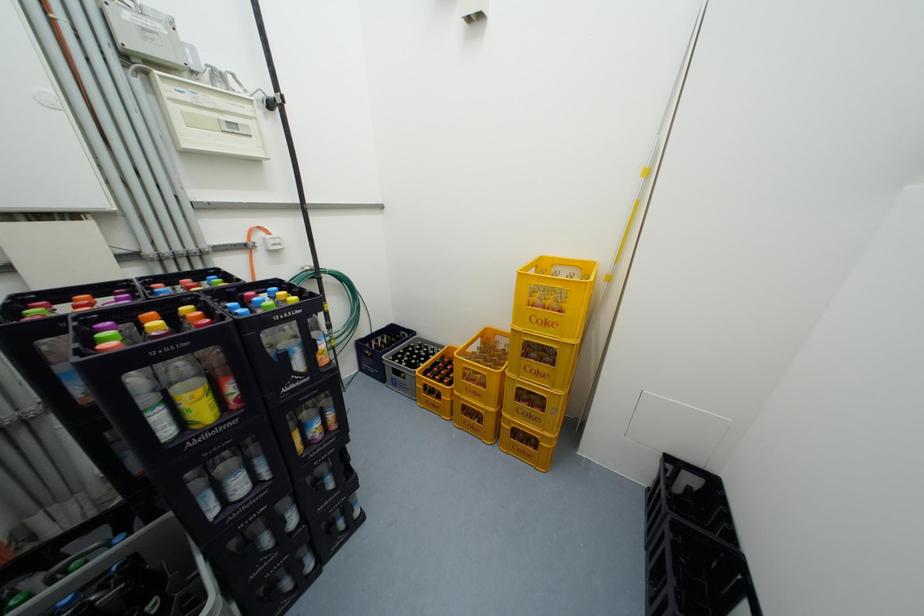
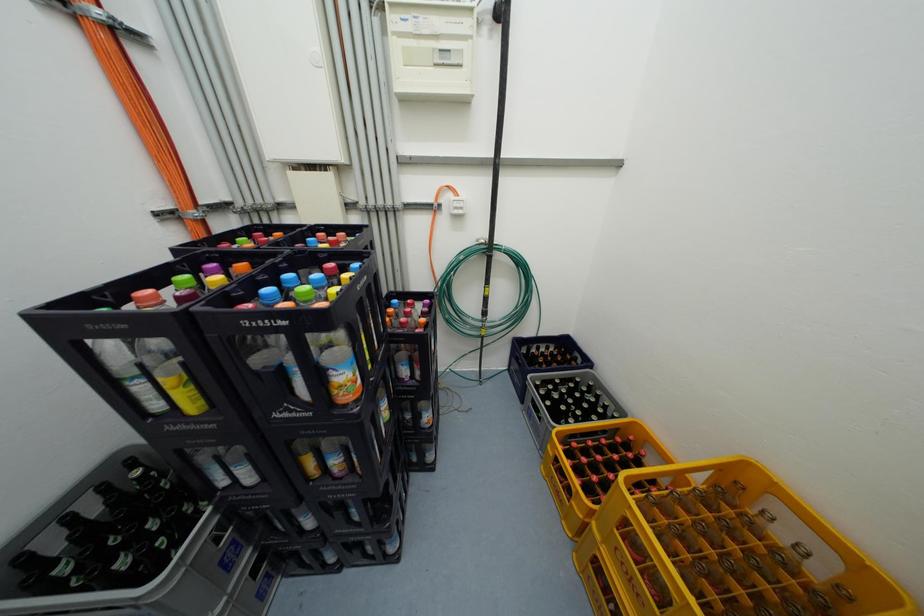
Question: The first image is from the beginning of the video and the second image is from the end. How did the camera likely rotate when shooting the video?

Choices:
 (A) Left
 (B) Right
 (C) Up
 (D) Down

Answer: (A)